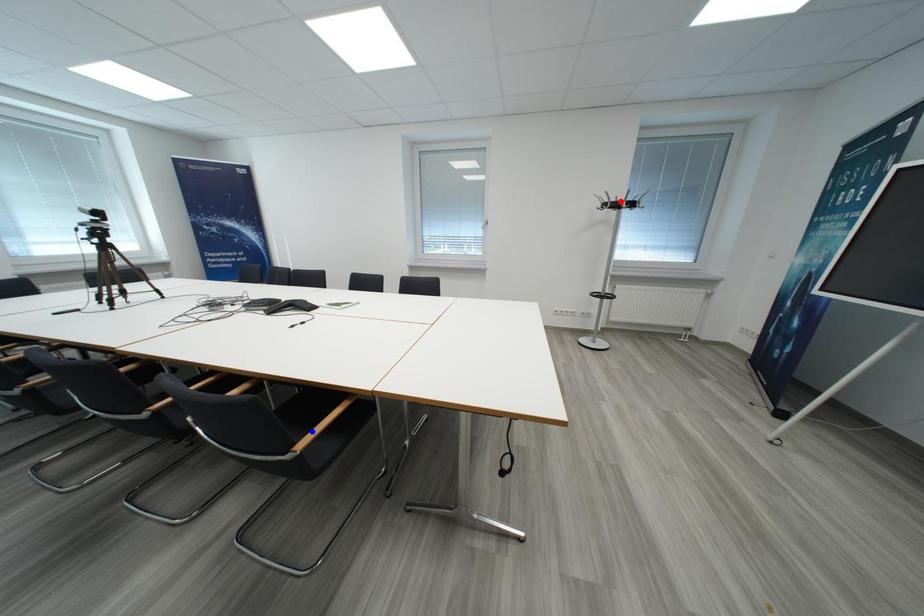
Question: In the image, two points are highlighted. Which point is nearer to the camera? Reply with the corresponding letter.

Choices:
 (A) blue point
 (B) red point

Answer: (A)